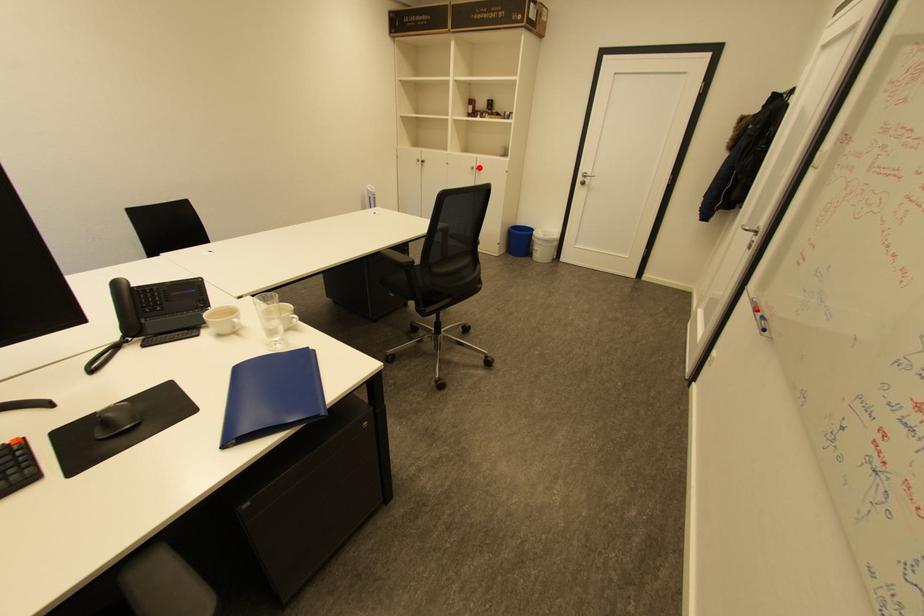
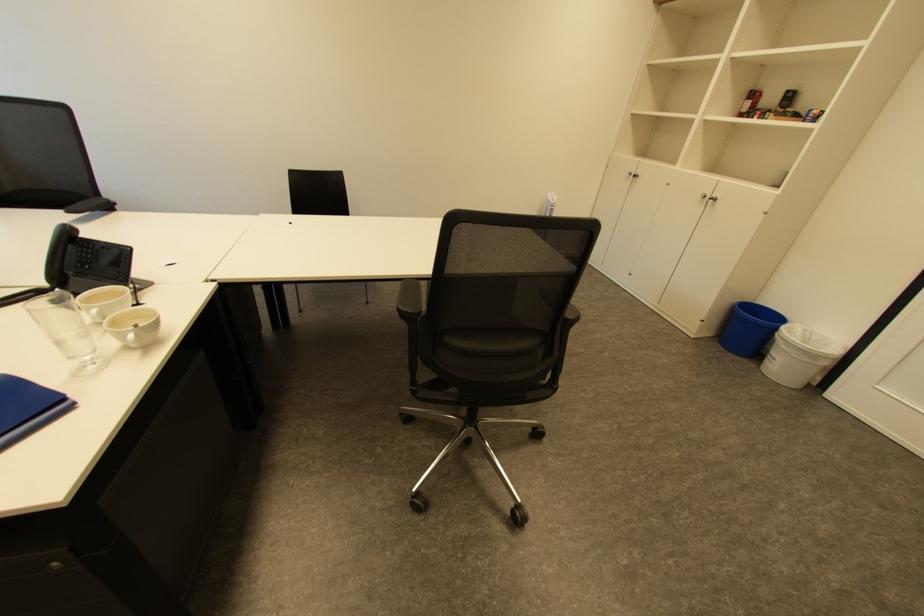
Question: I am providing you with two images of the same scene from different viewpoints. In image1, a red point is highlighted. Considering the same 3D point in image2, which of the following is correct?

Choices:
 (A) It is closer
 (B) It is farther

Answer: (A)